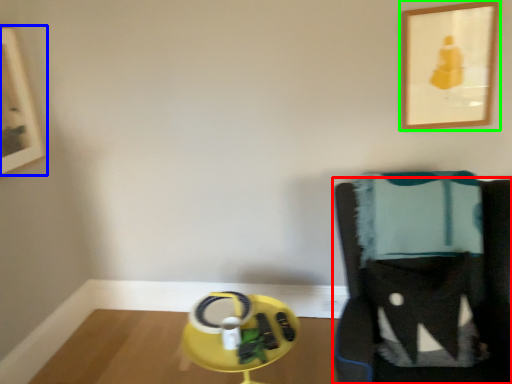
Question: Which object is positioned farthest from furniture (highlighted by a red box)? Select from picture frame (highlighted by a blue box) and picture frame (highlighted by a green box).

Choices:
 (A) picture frame
 (B) picture frame

Answer: (A)